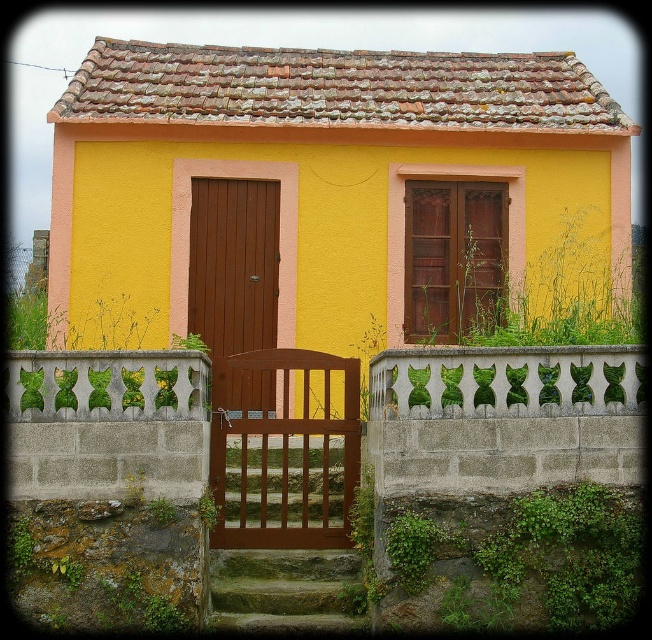
You are standing in front of the house and want to enter through the brown wooden door at center. However, the brown wooden gate at center is blocking your path. Which direction should you move to go around the gate and reach the door?

The brown wooden gate at center is to the right of the brown wooden door at center, so you should move to the left side of the gate to reach the door.

Looking at this image, you are a delivery person with a large package that requires a 1.2 meter wide opening to pass through. You see the brown wooden gate at center and the brown wooden door at center. Which one can you use to deliver the package?

The brown wooden gate at center is wider than the brown wooden door at center, so the delivery person can use the brown wooden gate at center to deliver the package since its width surpasses the required 1.2 meters.

You are standing at the entrance of the house and want to walk through the brown wooden gate at center. Based on its position coordinates, can you determine if the gate is positioned directly in front of you or slightly to one side?

The brown wooden gate at center is positioned at coordinates point [284,449], which indicates it is slightly to the right of the center point, so it is positioned slightly to one side rather than directly in front.